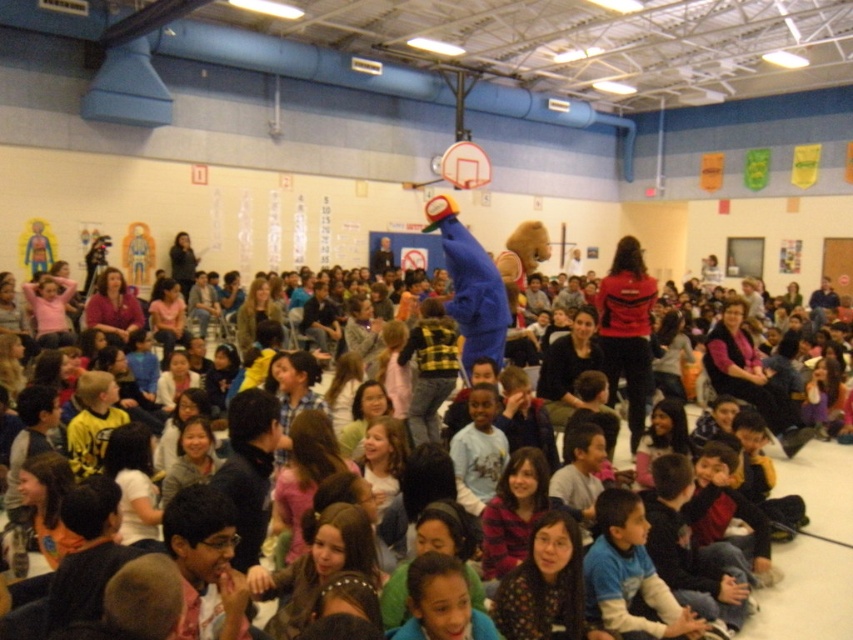
You are a stage designer planning to place a new banner between the matte blue mascot at center and the metallic silver basketball hoop at upper center. Since the mascot is wider than the basketball hoop, which object requires more space horizontally to accommodate the banner?

The matte blue mascot at center requires more horizontal space because its width surpasses that of the metallic silver basketball hoop at upper center.

Based on the photo, you are a photographer standing at the back of the gymnasium. You want to take a photo of the matte blue mascot at center and the metallic silver basketball hoop at upper center. Will the mascot block the view of the basketball hoop in your photo?

The matte blue mascot at center is in front of the metallic silver basketball hoop at upper center, so the mascot will block the view of the basketball hoop in the photo.